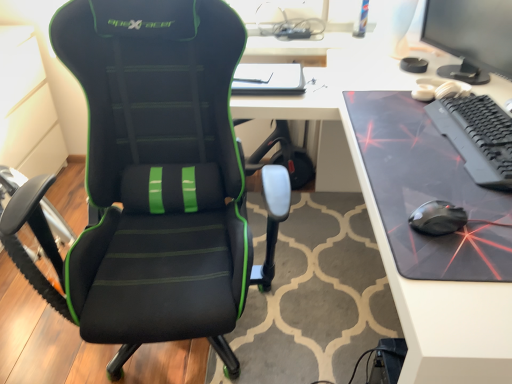
What are the coordinates of `vacant area that is situated to the right of black glossy mouse at right` in the screenshot? It's located at (486, 213).